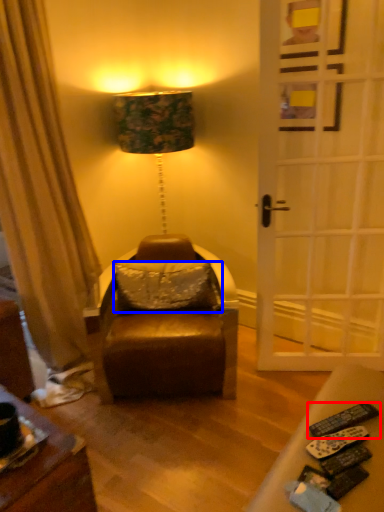
Question: Which object is closer to the camera taking this photo, remote control (highlighted by a red box) or pillow (highlighted by a blue box)?

Choices:
 (A) remote control
 (B) pillow

Answer: (A)